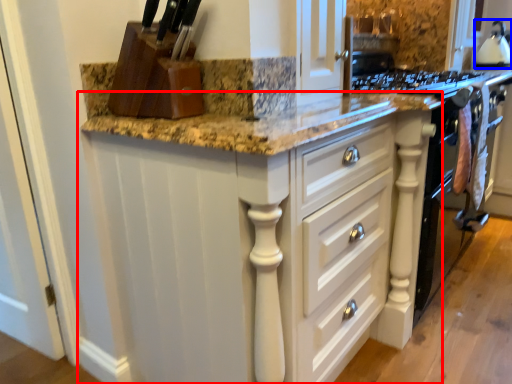
Question: Which of the following is the closest to the observer, cabinetry (highlighted by a red box) or kitchen appliance (highlighted by a blue box)?

Choices:
 (A) cabinetry
 (B) kitchen appliance

Answer: (A)